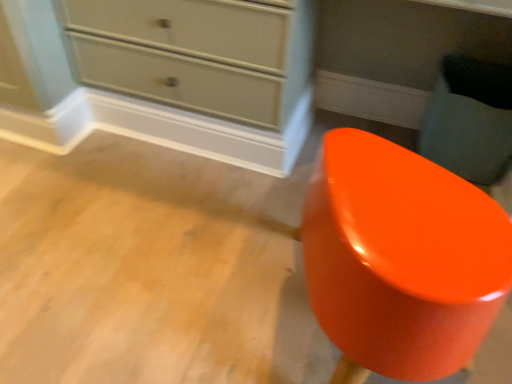
This screenshot has height=384, width=512. Find the location of `vacant area on top of glossy orange stool at lower right (from a real-world perspective)`. vacant area on top of glossy orange stool at lower right (from a real-world perspective) is located at coordinates (406, 208).